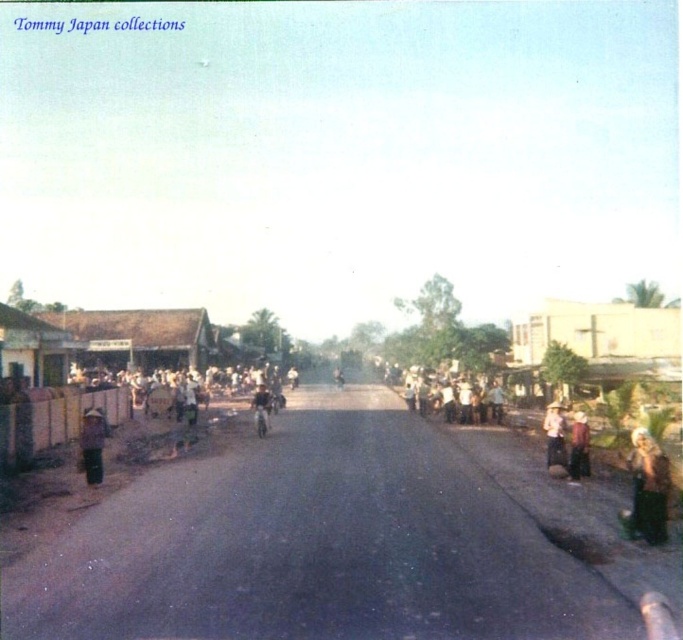
Question: Does light brown straw hat at left have a larger size compared to brown fabric dress at right?

Choices:
 (A) yes
 (B) no

Answer: (A)

Question: Which of the following is the farthest from the observer?

Choices:
 (A) brown fabric dress at right
 (B) light brown straw hat at left
 (C) white straw hat at center
 (D) light brown hair at lower right

Answer: (C)

Question: Can you confirm if light brown hair at lower right is bigger than light brown straw hat at left?

Choices:
 (A) no
 (B) yes

Answer: (B)

Question: Which point appears farthest from the camera in this image?

Choices:
 (A) (85, 452)
 (B) (262, 410)
 (C) (637, 467)

Answer: (B)

Question: Which object is farther from the camera taking this photo?

Choices:
 (A) white straw hat at center
 (B) light brown leather jacket at center
 (C) light brown straw hat at left

Answer: (B)

Question: Can you confirm if light brown hair at lower right is wider than white straw hat at center?

Choices:
 (A) no
 (B) yes

Answer: (A)